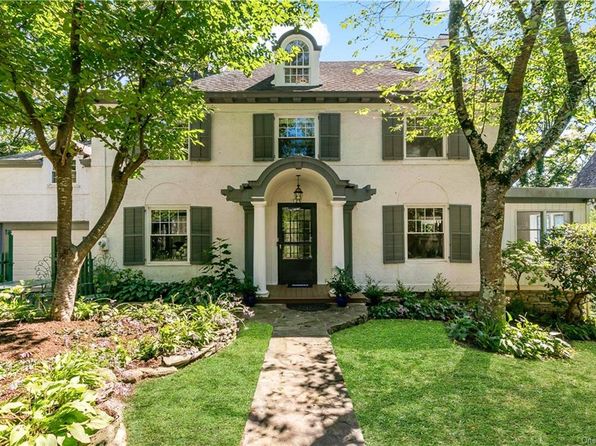
The image size is (596, 446). What are the coordinates of `the front door` in the screenshot? It's located at (299, 247).